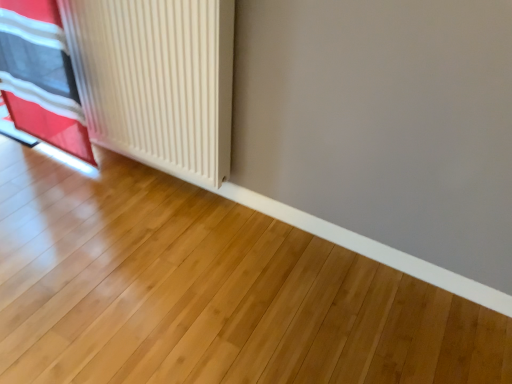
The width and height of the screenshot is (512, 384). What do you see at coordinates (157, 80) in the screenshot?
I see `white matte radiator at left` at bounding box center [157, 80].

Where is `white matte radiator at left`? The height and width of the screenshot is (384, 512). white matte radiator at left is located at coordinates (157, 80).

Describe the element at coordinates (41, 76) in the screenshot. I see `red fabric curtain at left` at that location.

The height and width of the screenshot is (384, 512). I want to click on red fabric curtain at left, so click(x=41, y=76).

What are the coordinates of `white matte radiator at left` in the screenshot? It's located at (157, 80).

Based on their positions, is red fabric curtain at left located to the left or right of white matte radiator at left?

red fabric curtain at left is positioned on white matte radiator at left's left side.

Considering the positions of objects red fabric curtain at left and white matte radiator at left in the image provided, who is in front, red fabric curtain at left or white matte radiator at left?

Positioned in front is white matte radiator at left.

Between point (20, 32) and point (135, 110), which one is positioned in front?

The point (20, 32) is closer.

From the image's perspective, is red fabric curtain at left above or below white matte radiator at left?

Based on their image positions, red fabric curtain at left is located above white matte radiator at left.

From a real-world perspective, between red fabric curtain at left and white matte radiator at left, who is vertically lower?

red fabric curtain at left.

Can you confirm if red fabric curtain at left is wider than white matte radiator at left?

Incorrect, the width of red fabric curtain at left does not surpass that of white matte radiator at left.

From their relative heights in the image, would you say red fabric curtain at left is taller or shorter than white matte radiator at left?

Clearly, red fabric curtain at left is taller compared to white matte radiator at left.

Between red fabric curtain at left and white matte radiator at left, which one has larger size?

Bigger between the two is white matte radiator at left.

Choose the correct answer: Is red fabric curtain at left inside white matte radiator at left or outside it?

The correct answer is: outside.

Is the surface of red fabric curtain at left in direct contact with white matte radiator at left?

red fabric curtain at left is not next to white matte radiator at left, and they're not touching.

Is red fabric curtain at left oriented away from white matte radiator at left?

That's not correct — red fabric curtain at left is not looking away from white matte radiator at left.

How distant is red fabric curtain at left from white matte radiator at left?

red fabric curtain at left is 12.31 inches from white matte radiator at left.

Identify the location of curtain above the white matte radiator at left (from the image's perspective). coord(41,76).

In the image, is white matte radiator at left on the left side or the right side of red fabric curtain at left?

Based on their positions, white matte radiator at left is located to the right of red fabric curtain at left.

Is the depth of white matte radiator at left less than that of red fabric curtain at left?

That is True.

Which is closer, (218, 175) or (53, 118)?

The point (218, 175) is closer.

From the image's perspective, which is above, white matte radiator at left or red fabric curtain at left?

red fabric curtain at left appears higher in the image.

From a real-world perspective, is white matte radiator at left below red fabric curtain at left?

No, from a real-world perspective, white matte radiator at left is not below red fabric curtain at left.

In terms of width, does white matte radiator at left look wider or thinner when compared to red fabric curtain at left?

In the image, white matte radiator at left appears to be wider than red fabric curtain at left.

Can you confirm if white matte radiator at left is shorter than red fabric curtain at left?

Yes, white matte radiator at left is shorter than red fabric curtain at left.

Is white matte radiator at left smaller than red fabric curtain at left?

Actually, white matte radiator at left might be larger than red fabric curtain at left.

Would you say white matte radiator at left is inside or outside red fabric curtain at left?

The correct answer is: outside.

Is white matte radiator at left positioned far away from red fabric curtain at left?

white matte radiator at left is actually quite close to red fabric curtain at left.

Is white matte radiator at left looking in the opposite direction of red fabric curtain at left?

white matte radiator at left is not turned away from red fabric curtain at left.

How much distance is there between white matte radiator at left and red fabric curtain at left?

white matte radiator at left is 12.31 inches from red fabric curtain at left.

You are a GUI agent. You are given a task and a screenshot of the screen. Output one action in this format:
    pyautogui.click(x=<x>, y=<y>)
    Task: Click on the curtain below the white matte radiator at left (from a real-world perspective)
    
    Given the screenshot: What is the action you would take?
    pyautogui.click(x=41, y=76)

The width and height of the screenshot is (512, 384). I want to click on curtain lying above the white matte radiator at left (from the image's perspective), so click(x=41, y=76).

Find the location of `radiator below the red fabric curtain at left (from the image's perspective)`. radiator below the red fabric curtain at left (from the image's perspective) is located at coordinates tap(157, 80).